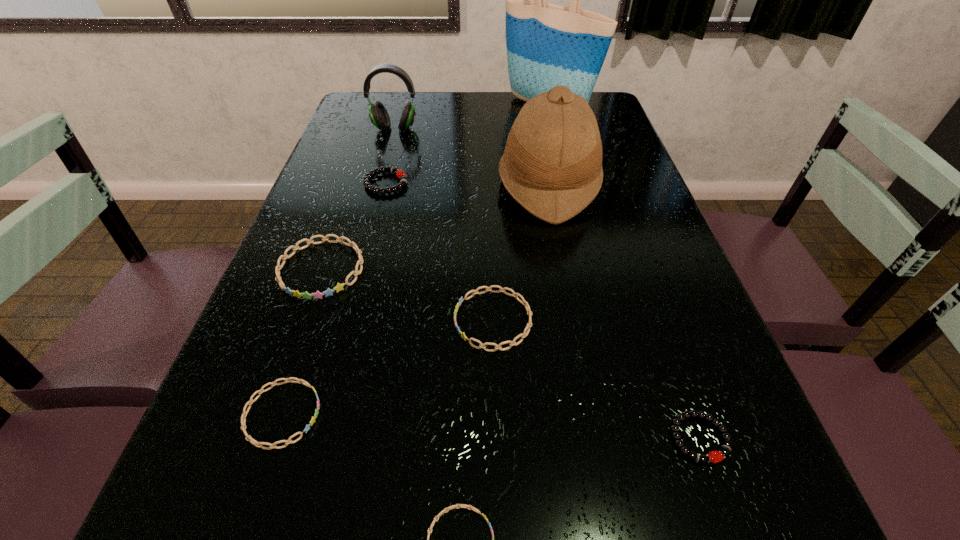
Locate which object is the fourth closest to the biggest blue bracelet. Please provide its 2D coordinates. Your answer should be formatted as a tuple, i.e. [(x, y)], where the tuple contains the x and y coordinates of a point satisfying the conditions above.

[(552, 163)]

Locate which object is the second closest to the biggest blue bracelet. Please provide its 2D coordinates. Your answer should be formatted as a tuple, i.e. [(x, y)], where the tuple contains the x and y coordinates of a point satisfying the conditions above.

[(243, 418)]

Identify which bracelet is the third nearest to the third farthest blue bracelet. Please provide its 2D coordinates. Your answer should be formatted as a tuple, i.e. [(x, y)], where the tuple contains the x and y coordinates of a point satisfying the conditions above.

[(529, 312)]

Locate an element on the screen. Image resolution: width=960 pixels, height=540 pixels. the third closest bracelet to the bigger black bracelet is located at coordinates [243, 418].

Locate an element on the screen. This screenshot has width=960, height=540. blue bracelet identified as the second closest to the hat is located at coordinates (339, 286).

Select which blue bracelet appears as the fourth closest to the farthest bracelet. Please provide its 2D coordinates. Your answer should be formatted as a tuple, i.e. [(x, y)], where the tuple contains the x and y coordinates of a point satisfying the conditions above.

[(445, 510)]